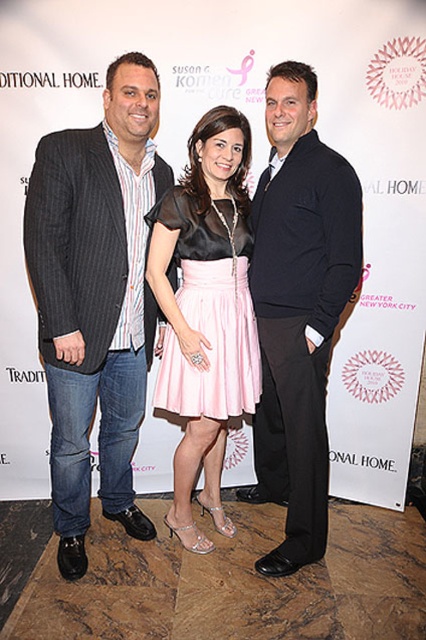
Who is higher up, striped cotton shirt at left or dark blue sweater at center?

striped cotton shirt at left

Between striped cotton shirt at left and dark blue sweater at center, which one has more height?

striped cotton shirt at left

Find the location of a particular element. This screenshot has height=640, width=426. striped cotton shirt at left is located at coordinates (95, 298).

Is striped cotton shirt at left taller than pink satin skirt at center?

Yes, striped cotton shirt at left is taller than pink satin skirt at center.

Which is more to the right, striped cotton shirt at left or pink satin skirt at center?

pink satin skirt at center is more to the right.

Is point (83, 212) positioned after point (247, 301)?

That is False.

This screenshot has width=426, height=640. Find the location of `striped cotton shirt at left`. striped cotton shirt at left is located at coordinates (95, 298).

Is dark blue sweater at center shorter than pink satin skirt at center?

No.

Is point (339, 262) farther from viewer compared to point (216, 417)?

No, (339, 262) is in front of (216, 417).

Is point (255, 276) less distant than point (221, 362)?

No, it is not.

Image resolution: width=426 pixels, height=640 pixels. I want to click on dark blue sweater at center, so coord(299,308).